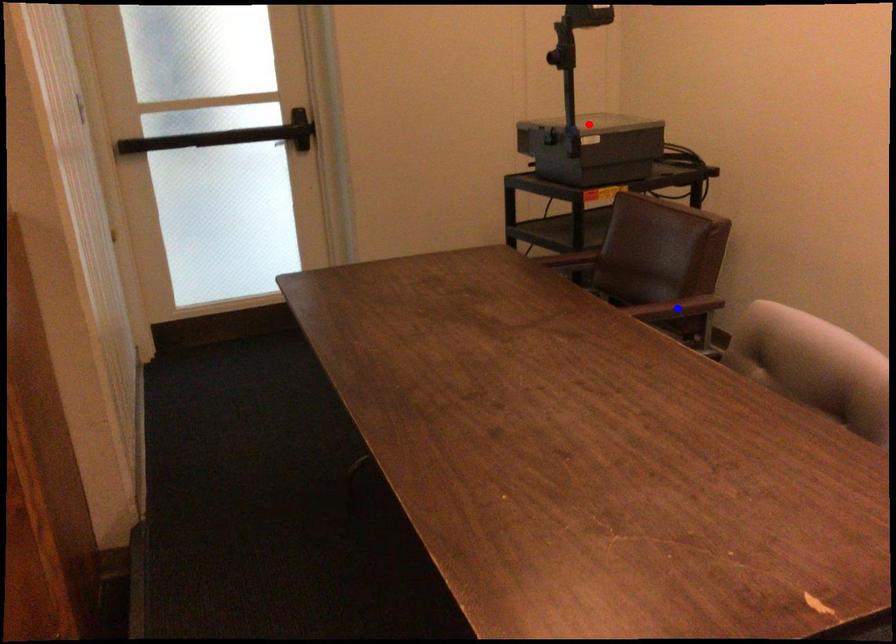
Question: Which of the two points in the image is closer to the camera?

Choices:
 (A) Blue point is closer.
 (B) Red point is closer.

Answer: (B)